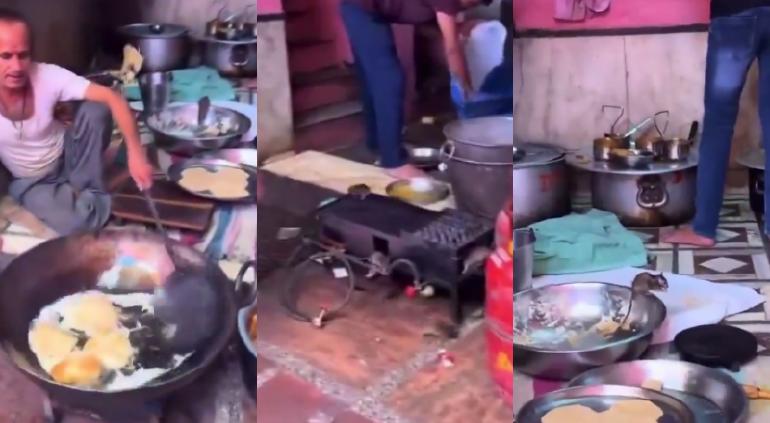
Identify the location of pot. (536, 188), (630, 188).